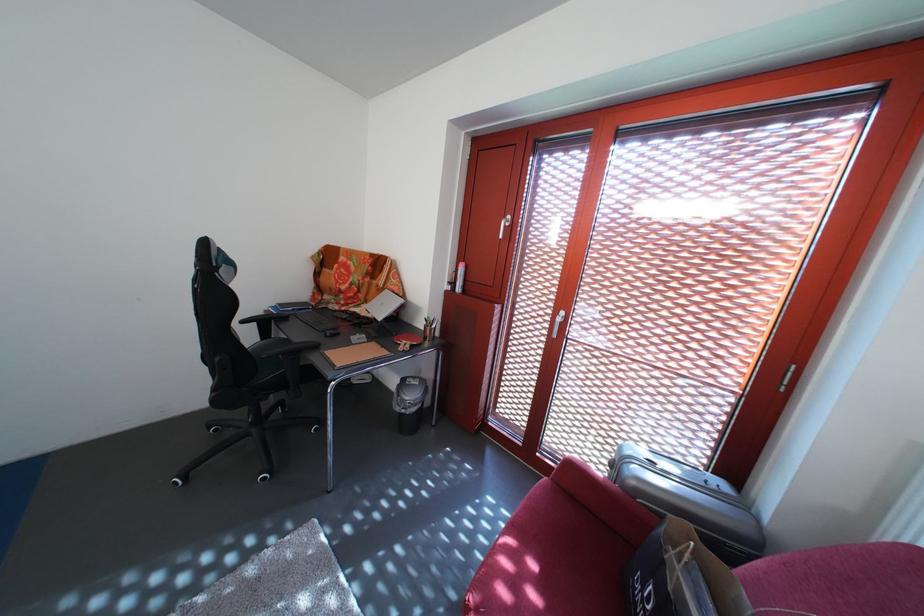
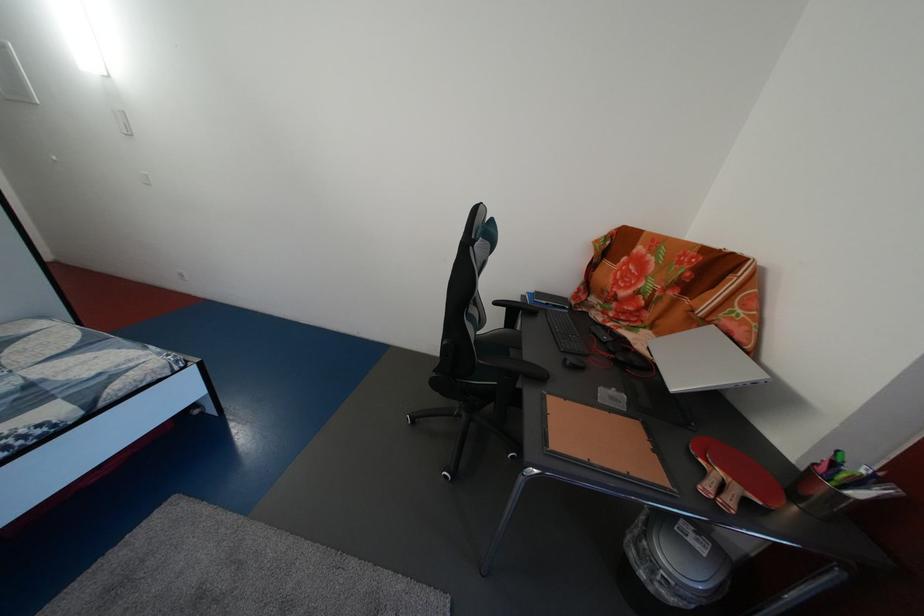
Find the pixel in the second image that matches [419,350] in the first image.

(748, 496)